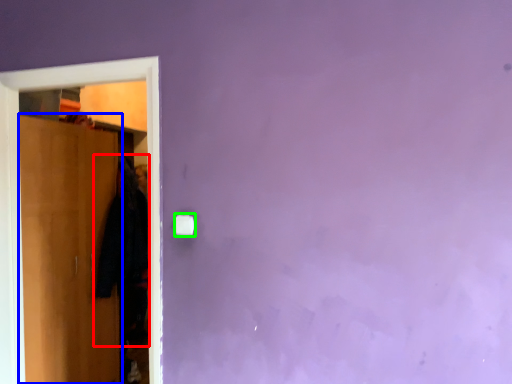
Question: Which is farther away from clothing (highlighted by a red box)? door (highlighted by a blue box) or light switch (highlighted by a green box)?

Choices:
 (A) door
 (B) light switch

Answer: (B)